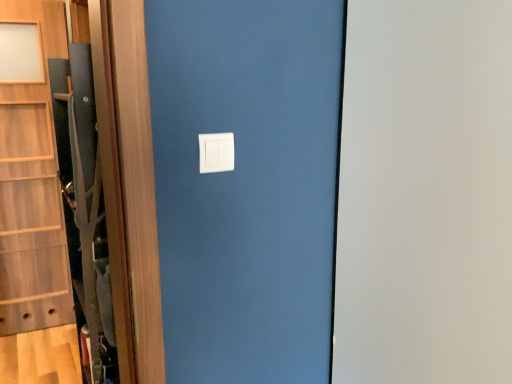
Where is `wooden door at left`? This screenshot has width=512, height=384. wooden door at left is located at coordinates (34, 216).

Describe the element at coordinates (34, 216) in the screenshot. This screenshot has height=384, width=512. I see `wooden door at left` at that location.

The image size is (512, 384). I want to click on wooden door at left, so click(34, 216).